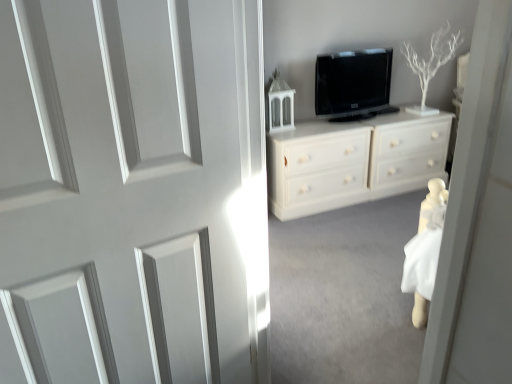
Question: Considering their positions, is black glossy tv at upper center located in front of or behind white painted wood door at center?

Choices:
 (A) front
 (B) behind

Answer: (B)

Question: In terms of size, does black glossy tv at upper center appear bigger or smaller than white painted wood door at center?

Choices:
 (A) small
 (B) big

Answer: (A)

Question: Based on their relative distances, which object is farther from the white painted wood chest of drawers at center?

Choices:
 (A) black glossy tv at upper center
 (B) white painted wood door at center

Answer: (B)

Question: Considering the real-world distances, which object is farthest from the black glossy tv at upper center?

Choices:
 (A) white painted wood chest of drawers at center
 (B) white painted wood door at center

Answer: (B)